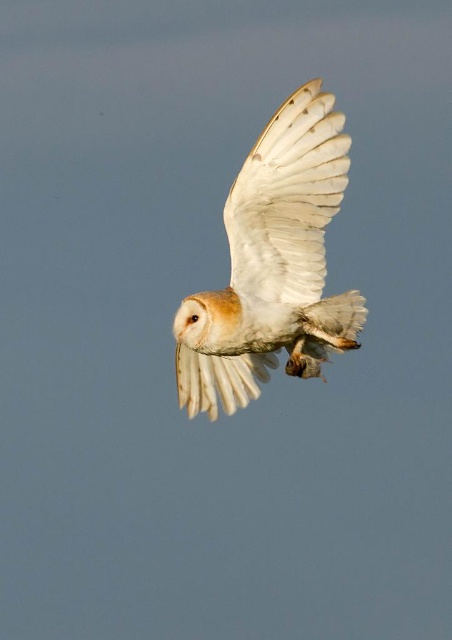
Is white feathered owl at center below white feathered wing at center?

Indeed, white feathered owl at center is positioned under white feathered wing at center.

Does point (249, 301) come behind point (241, 260)?

No, it is in front of (241, 260).

Is point (245, 237) in front of point (319, 280)?

Yes, it is in front of point (319, 280).

The image size is (452, 640). Find the location of `white feathered owl at center`. white feathered owl at center is located at coordinates (273, 264).